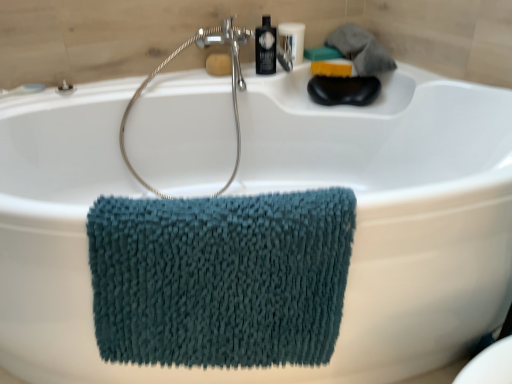
Question: Does yellow sponge at upper center, placed as the 2th soap when sorted from right to left, have a lesser width compared to satin nickel showerhead at upper center?

Choices:
 (A) yes
 (B) no

Answer: (A)

Question: Can we say yellow sponge at upper center, which appears as the first soap when viewed from the left, lies outside satin nickel showerhead at upper center?

Choices:
 (A) no
 (B) yes

Answer: (A)

Question: Does yellow sponge at upper center, which appears as the first soap when viewed from the left, appear on the right side of satin nickel showerhead at upper center?

Choices:
 (A) no
 (B) yes

Answer: (B)

Question: Is yellow sponge at upper center, which appears as the first soap when viewed from the left, facing towards satin nickel showerhead at upper center?

Choices:
 (A) yes
 (B) no

Answer: (A)

Question: Can you confirm if yellow sponge at upper center, which appears as the first soap when viewed from the left, is taller than satin nickel showerhead at upper center?

Choices:
 (A) yes
 (B) no

Answer: (B)

Question: Is yellow sponge at upper center, which appears as the first soap when viewed from the left, at the left side of satin nickel showerhead at upper center?

Choices:
 (A) no
 (B) yes

Answer: (A)

Question: Is yellow sponge at upper center, which appears as the first soap when viewed from the left, at the left side of black glossy bottle at upper center?

Choices:
 (A) yes
 (B) no

Answer: (A)

Question: Is the position of yellow sponge at upper center, which appears as the first soap when viewed from the left, more distant than that of black glossy bottle at upper center?

Choices:
 (A) no
 (B) yes

Answer: (B)

Question: Can you confirm if yellow sponge at upper center, which appears as the first soap when viewed from the left, is shorter than black glossy bottle at upper center?

Choices:
 (A) yes
 (B) no

Answer: (A)

Question: Is yellow sponge at upper center, which appears as the first soap when viewed from the left, bigger than black glossy bottle at upper center?

Choices:
 (A) no
 (B) yes

Answer: (A)

Question: Can you confirm if yellow sponge at upper center, which appears as the first soap when viewed from the left, is thinner than black glossy bottle at upper center?

Choices:
 (A) yes
 (B) no

Answer: (A)

Question: From a real-world perspective, is yellow sponge at upper center, which appears as the first soap when viewed from the left, below black glossy bottle at upper center?

Choices:
 (A) yes
 (B) no

Answer: (A)

Question: From the image's perspective, would you say yellow sponge at upper center, placed as the 2th soap when sorted from right to left, is shown under teal chenille towel at center?

Choices:
 (A) yes
 (B) no

Answer: (B)